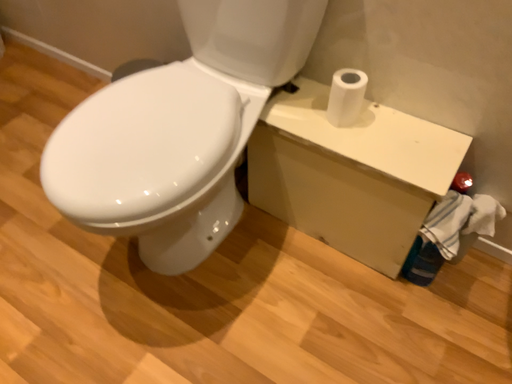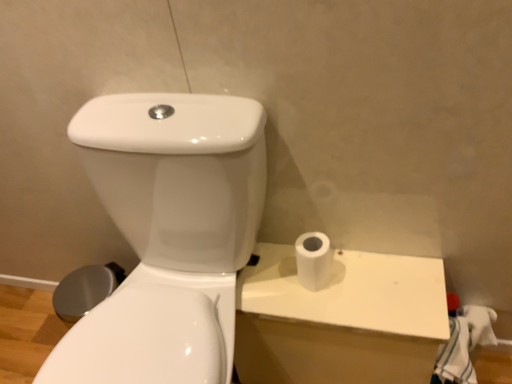
Question: How did the camera likely rotate when shooting the video?

Choices:
 (A) rotated upward
 (B) rotated downward

Answer: (A)